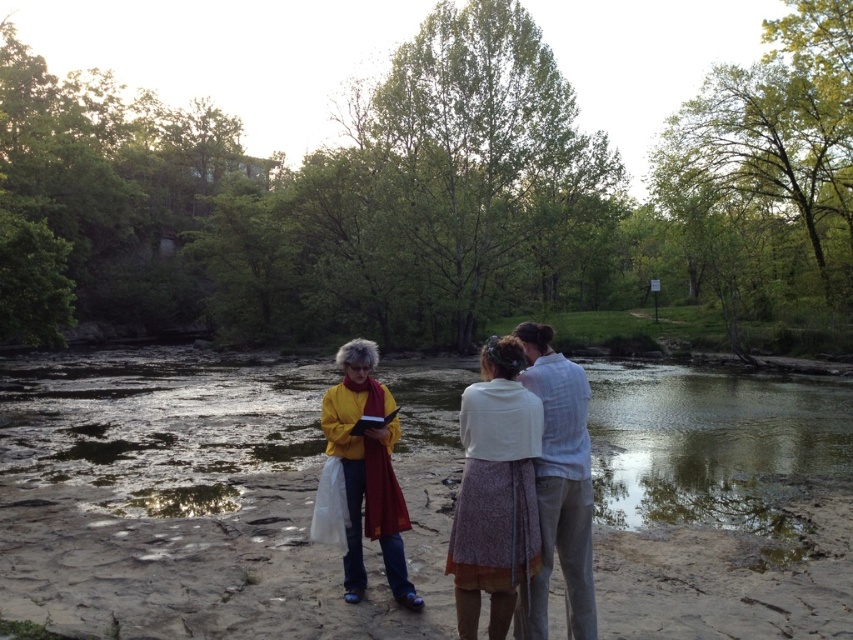
Is white cotton dress at center below yellow matte sweater at center?

Indeed, white cotton dress at center is positioned under yellow matte sweater at center.

Does white cotton dress at center have a lesser height compared to yellow matte sweater at center?

Yes, white cotton dress at center is shorter than yellow matte sweater at center.

At what (x,y) coordinates should I click in order to perform the action: click on white cotton dress at center. Please return your answer as a coordinate pair (x, y). Looking at the image, I should click on (524, 490).

Between white cotton dress at center and light blue cotton shirt at center, which one is positioned higher?

Positioned higher is white cotton dress at center.

Is white cotton dress at center positioned at the back of light blue cotton shirt at center?

No.

Locate an element on the screen. This screenshot has height=640, width=853. white cotton dress at center is located at coordinates click(x=524, y=490).

The height and width of the screenshot is (640, 853). In order to click on white cotton dress at center in this screenshot , I will do `click(524, 490)`.

Can you confirm if light blue cotton shirt at center is wider than yellow matte sweater at center?

In fact, light blue cotton shirt at center might be narrower than yellow matte sweater at center.

Is light blue cotton shirt at center thinner than yellow matte sweater at center?

Indeed, light blue cotton shirt at center has a lesser width compared to yellow matte sweater at center.

Between point (561, 456) and point (393, 550), which one is positioned in front?

Point (561, 456) is in front.

Identify the location of light blue cotton shirt at center. The width and height of the screenshot is (853, 640). (560, 488).